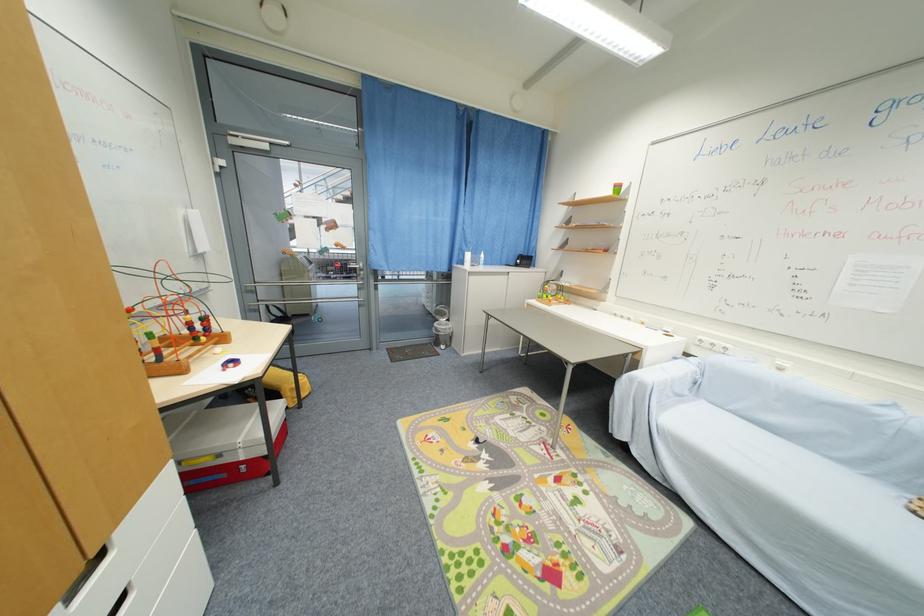
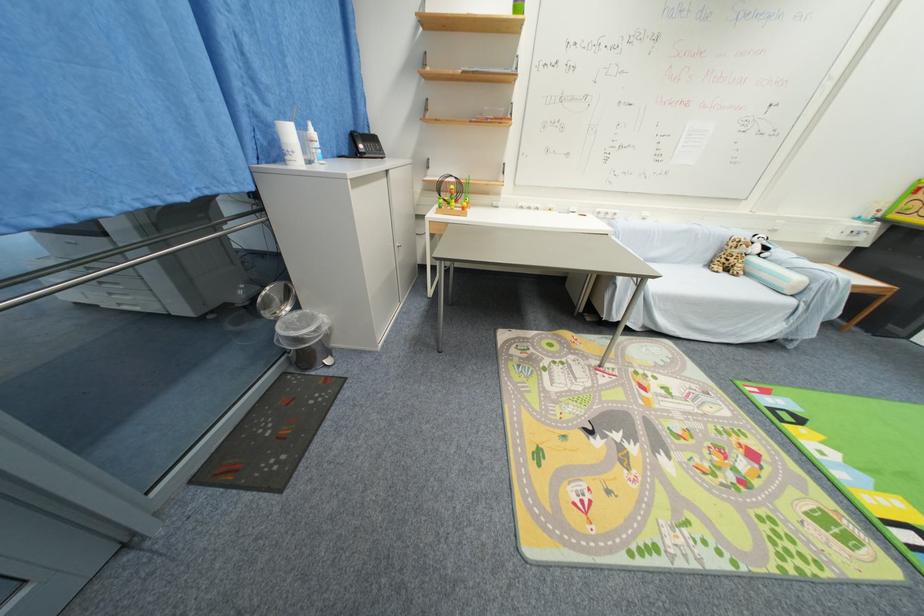
Where in the second image is the point corresponding to (529,264) from the first image?

(377, 148)